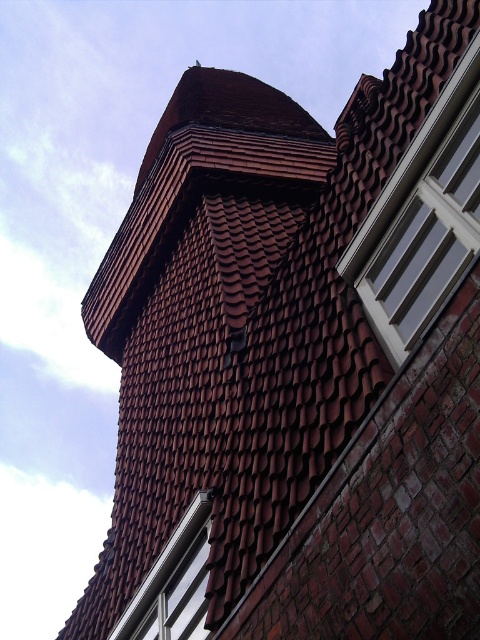
Is white glossy window at upper right to the right of white plastic window at lower left from the viewer's perspective?

Correct, you'll find white glossy window at upper right to the right of white plastic window at lower left.

The width and height of the screenshot is (480, 640). I want to click on white glossy window at upper right, so click(x=421, y=220).

Image resolution: width=480 pixels, height=640 pixels. I want to click on white glossy window at upper right, so tap(421, 220).